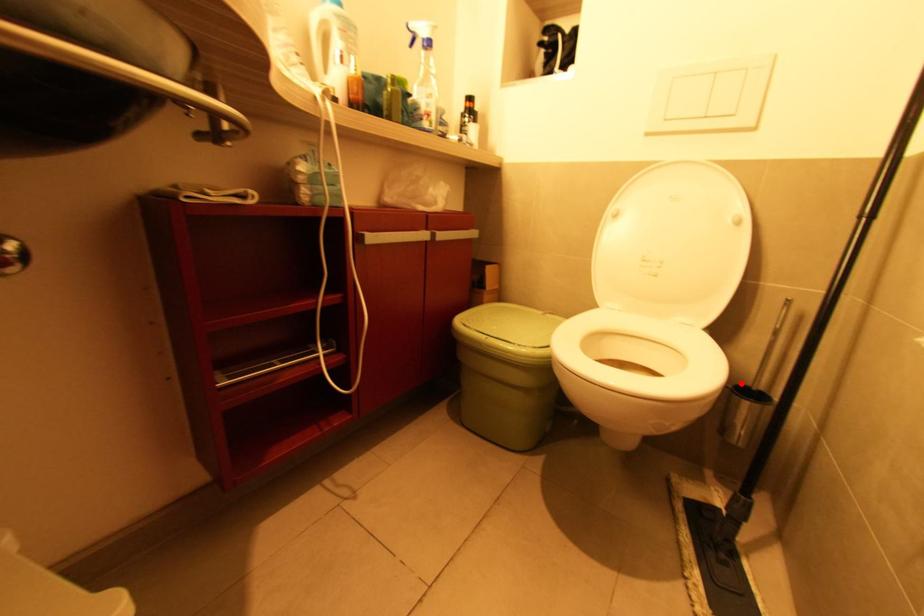
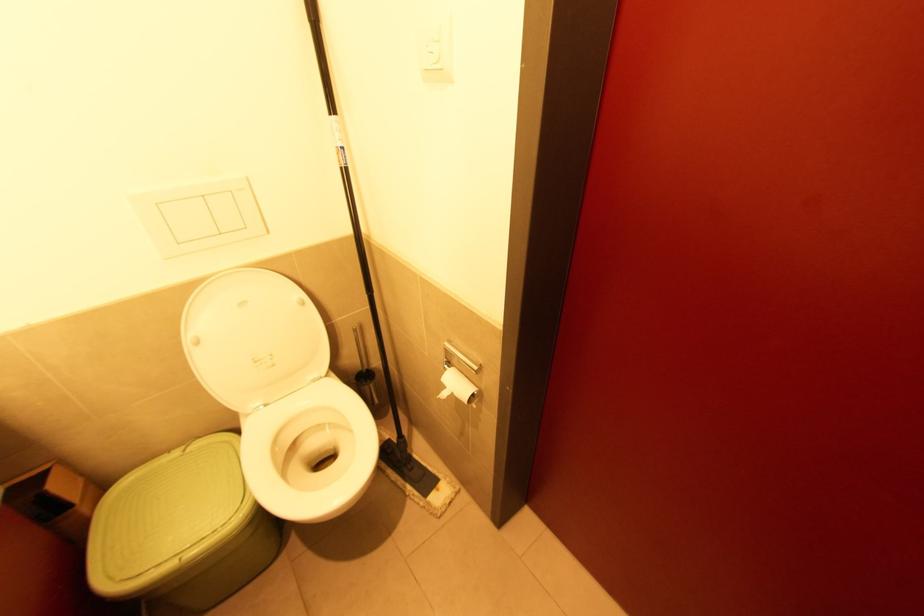
Where in the second image is the point corresponding to the highlighted location from the first image?

(358, 374)